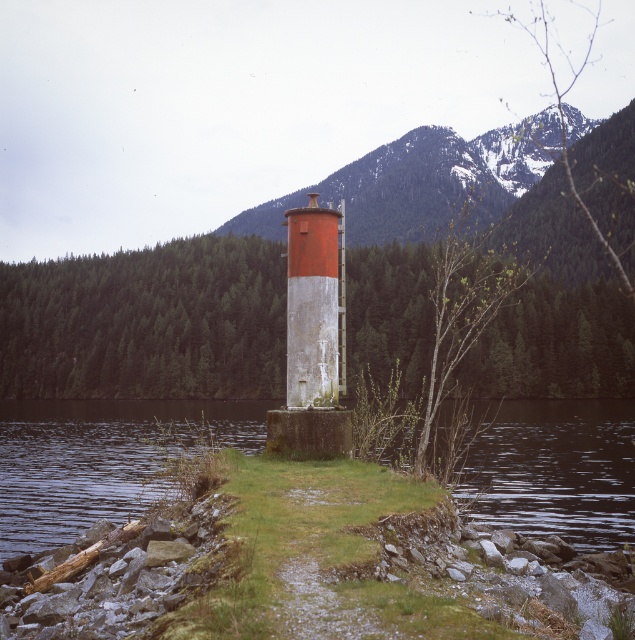
Looking at this image, between snowy rocky mountain at center and red painted concrete tower at center, which one appears on the left side from the viewer's perspective?

red painted concrete tower at center

Is the position of snowy rocky mountain at center less distant than that of red painted concrete tower at center?

That is False.

Describe the element at coordinates (422, 180) in the screenshot. This screenshot has height=640, width=635. I see `snowy rocky mountain at center` at that location.

Where is `snowy rocky mountain at center`? The height and width of the screenshot is (640, 635). snowy rocky mountain at center is located at coordinates (422, 180).

Is point (95, 513) behind point (295, 276)?

That is True.

Identify the location of clear water at lower center. The height and width of the screenshot is (640, 635). (98, 460).

Locate an element on the screen. clear water at lower center is located at coordinates (98, 460).

Who is more distant from viewer, (631,464) or (277,212)?

Point (277,212)

Between point (3, 442) and point (411, 179), which one is positioned in front?

Point (3, 442) is more forward.

Is point (121, 400) closer to viewer compared to point (444, 163)?

That is True.

This screenshot has width=635, height=640. I want to click on clear water at lower center, so pos(98,460).